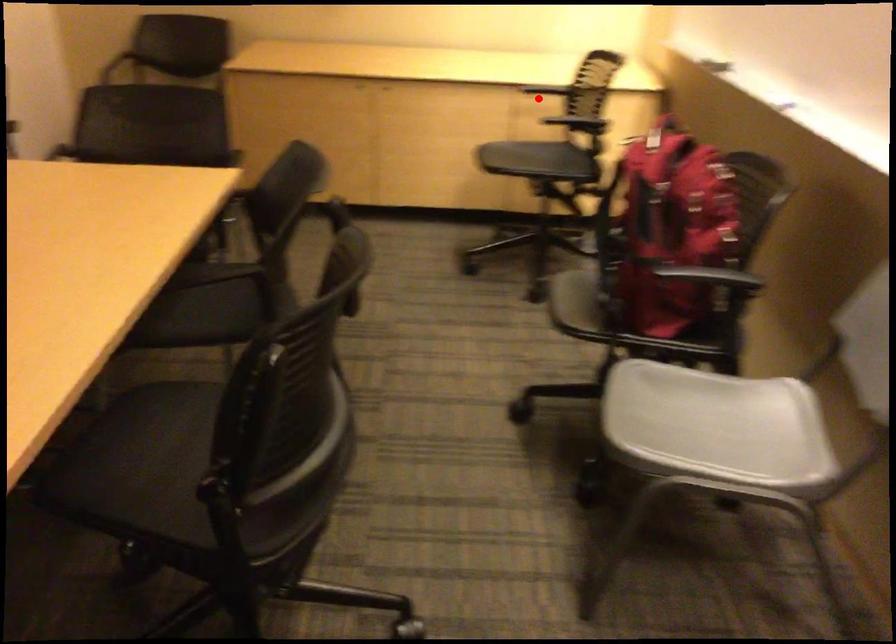
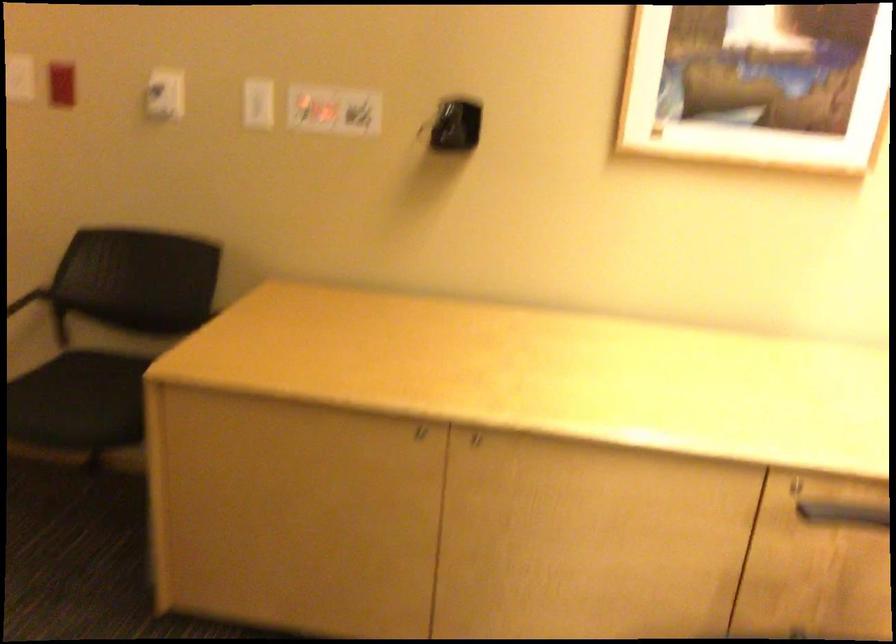
Question: I am providing you with two images of the same scene from different viewpoints. Given a red point in image1, look at the same physical point in image2. Is it:

Choices:
 (A) Closer to the viewpoint
 (B) Farther from the viewpoint

Answer: (A)